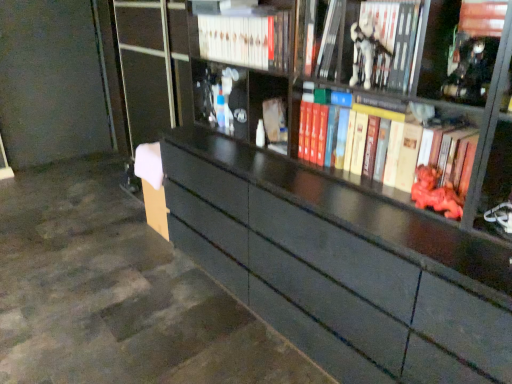
Question: Which direction should I rotate to face hardcover book at upper center, acting as the third book starting from the right, — up or down?

Choices:
 (A) up
 (B) down

Answer: (A)

Question: From a real-world perspective, is red matte book at upper right, the fourth book from the left, beneath matte white book at center?

Choices:
 (A) yes
 (B) no

Answer: (B)

Question: Does red matte book at upper right, the 1th book from the right, appear on the left side of matte white book at center?

Choices:
 (A) yes
 (B) no

Answer: (B)

Question: Is red matte book at upper right, the 1th book from the right, positioned with its back to matte white book at center?

Choices:
 (A) yes
 (B) no

Answer: (B)

Question: Is red matte book at upper right, the 1th book from the right, far from matte white book at center?

Choices:
 (A) no
 (B) yes

Answer: (A)

Question: From a real-world perspective, is red matte book at upper right, the fourth book from the left, on top of matte white book at center?

Choices:
 (A) yes
 (B) no

Answer: (A)

Question: Is red matte book at upper right, the fourth book from the left, thinner than matte white book at center?

Choices:
 (A) no
 (B) yes

Answer: (A)

Question: Is metallic silver statue at upper right shorter than matte white book at center?

Choices:
 (A) yes
 (B) no

Answer: (B)

Question: From a real-world perspective, is metallic silver statue at upper right located higher than matte white book at center?

Choices:
 (A) no
 (B) yes

Answer: (B)

Question: From the image's perspective, is metallic silver statue at upper right on top of matte white book at center?

Choices:
 (A) yes
 (B) no

Answer: (A)

Question: Is metallic silver statue at upper right to the left of matte white book at center from the viewer's perspective?

Choices:
 (A) no
 (B) yes

Answer: (A)

Question: Is metallic silver statue at upper right not close to matte white book at center?

Choices:
 (A) no
 (B) yes

Answer: (A)

Question: From a real-world perspective, is metallic silver statue at upper right beneath matte white book at center?

Choices:
 (A) no
 (B) yes

Answer: (A)

Question: Is the depth of matte white book at center greater than that of metallic silver statue at upper right?

Choices:
 (A) no
 (B) yes

Answer: (B)